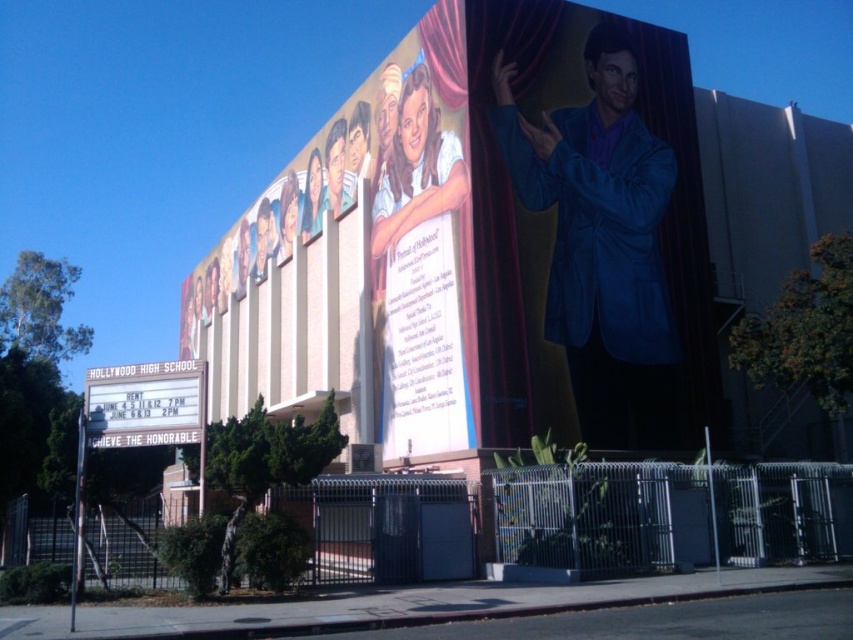
You are an architect designing a new mural for the school. You need to place a golden star sticker exactly at the center of the blue glossy suit at upper right. According to the coordinates provided, where should you place the sticker?

The golden star sticker should be placed at the center of the blue glossy suit at upper right, which is located at coordinates point (490, 243).